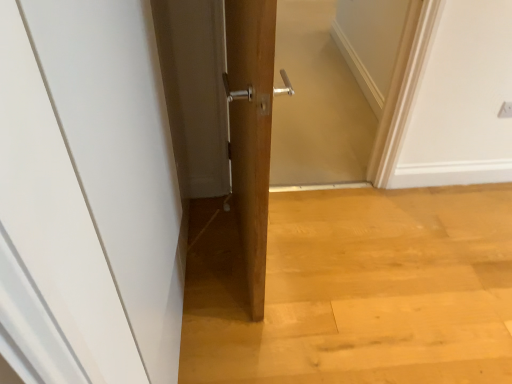
Question: Considering the relative sizes of white plastic electric outlet at upper right and wooden screen door at center in the image provided, is white plastic electric outlet at upper right shorter than wooden screen door at center?

Choices:
 (A) yes
 (B) no

Answer: (A)

Question: Is white plastic electric outlet at upper right positioned with its back to wooden screen door at center?

Choices:
 (A) yes
 (B) no

Answer: (B)

Question: Can you confirm if white plastic electric outlet at upper right is smaller than wooden screen door at center?

Choices:
 (A) yes
 (B) no

Answer: (A)

Question: Can you confirm if white plastic electric outlet at upper right is positioned to the left of wooden screen door at center?

Choices:
 (A) yes
 (B) no

Answer: (B)

Question: Can you confirm if white plastic electric outlet at upper right is bigger than wooden screen door at center?

Choices:
 (A) no
 (B) yes

Answer: (A)

Question: Is white plastic electric outlet at upper right wider than wooden screen door at center?

Choices:
 (A) no
 (B) yes

Answer: (A)

Question: Does white matte door at center have a smaller size compared to wooden screen door at center?

Choices:
 (A) no
 (B) yes

Answer: (B)

Question: Are white matte door at center and wooden screen door at center making contact?

Choices:
 (A) yes
 (B) no

Answer: (B)

Question: Is white matte door at center wider than wooden screen door at center?

Choices:
 (A) yes
 (B) no

Answer: (B)

Question: Can you confirm if white matte door at center is thinner than wooden screen door at center?

Choices:
 (A) yes
 (B) no

Answer: (A)

Question: Considering the relative sizes of white matte door at center and wooden screen door at center in the image provided, is white matte door at center taller than wooden screen door at center?

Choices:
 (A) yes
 (B) no

Answer: (A)

Question: From a real-world perspective, is white matte door at center on top of wooden screen door at center?

Choices:
 (A) no
 (B) yes

Answer: (B)

Question: From a real-world perspective, is wooden screen door at center on white plastic electric outlet at upper right?

Choices:
 (A) no
 (B) yes

Answer: (B)